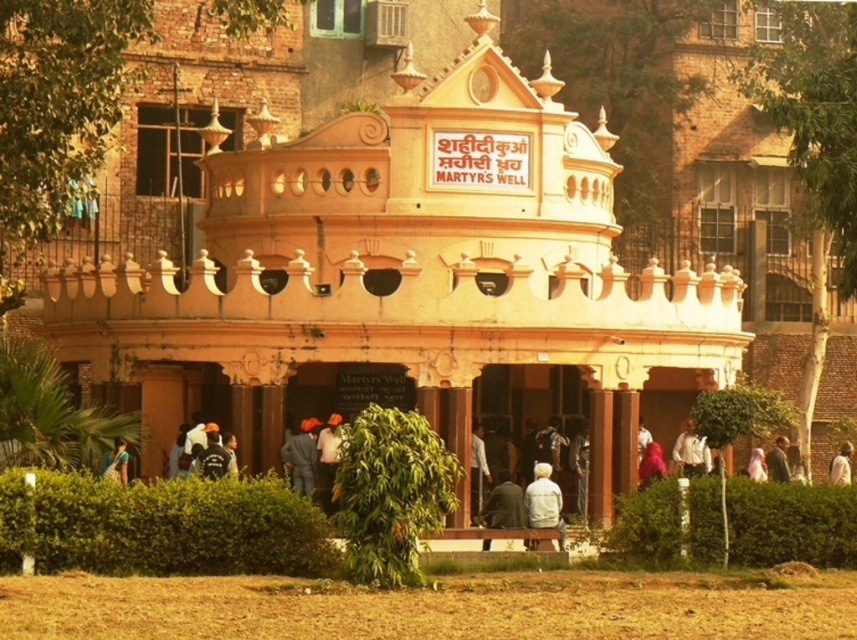
Is beige stone building at center taller than light brown fabric person at center?

Correct, beige stone building at center is much taller as light brown fabric person at center.

Does beige stone building at center have a larger size compared to light brown fabric person at center?

Indeed, beige stone building at center has a larger size compared to light brown fabric person at center.

Is point (447, 368) in front of point (776, 460)?

Yes, it is.

The width and height of the screenshot is (857, 640). I want to click on beige stone building at center, so click(x=406, y=273).

Does dark gray fabric jacket at center have a greater width compared to pink fabric at center?

No, dark gray fabric jacket at center is not wider than pink fabric at center.

Looking at this image, between dark gray fabric jacket at center and pink fabric at center, which one appears on the right side from the viewer's perspective?

Positioned to the right is pink fabric at center.

Is point (506, 492) farther from camera compared to point (760, 474)?

That is False.

Image resolution: width=857 pixels, height=640 pixels. I want to click on dark gray fabric jacket at center, so [x=504, y=506].

Does light gray fabric jacket at center have a lesser width compared to blue fabric at center?

Yes, light gray fabric jacket at center is thinner than blue fabric at center.

Can you confirm if light gray fabric jacket at center is positioned above blue fabric at center?

No, light gray fabric jacket at center is not above blue fabric at center.

Who is more distant from viewer, (550, 512) or (297, 474)?

The point (297, 474) is behind.

Locate an element on the screen. Image resolution: width=857 pixels, height=640 pixels. light gray fabric jacket at center is located at coordinates [544, 502].